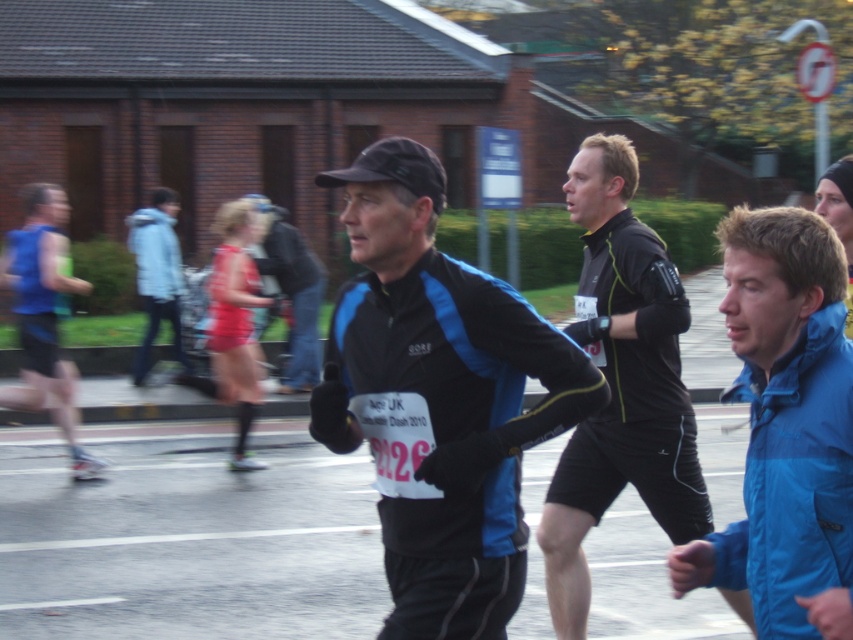
Question: Where is red fabric skirt at center located in relation to light blue jacket at center in the image?

Choices:
 (A) above
 (B) below

Answer: (B)

Question: Which of these objects is positioned farthest from the blue smooth jacket at lower right?

Choices:
 (A) black matte jacket at center
 (B) light blue jacket at center

Answer: (B)

Question: Which object is farther from the camera taking this photo?

Choices:
 (A) black matte jacket at center
 (B) blue smooth jacket at lower right
 (C) blue running vest at left
 (D) black matte running suit at center

Answer: (C)

Question: Is black matte jacket at center to the left of blue running vest at left from the viewer's perspective?

Choices:
 (A) yes
 (B) no

Answer: (B)

Question: Can you confirm if red fabric skirt at center is positioned below light blue fabric jacket at upper left?

Choices:
 (A) yes
 (B) no

Answer: (A)

Question: Which object is closer to the camera taking this photo?

Choices:
 (A) light blue jacket at center
 (B) blue fabric jacket at center
 (C) black matte running suit at center
 (D) blue running vest at left

Answer: (C)